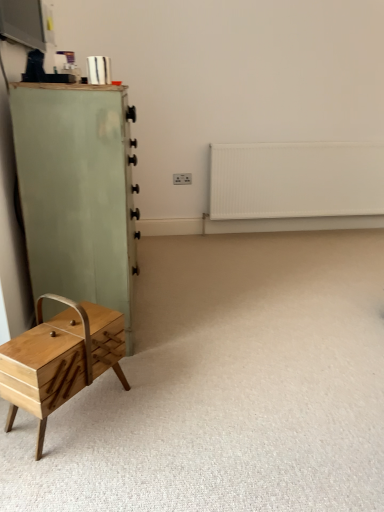
Question: Is the position of light green wood chest of drawers at left more distant than that of wooden sewing box at lower left?

Choices:
 (A) yes
 (B) no

Answer: (A)

Question: Would you say light green wood chest of drawers at left is outside wooden sewing box at lower left?

Choices:
 (A) no
 (B) yes

Answer: (B)

Question: Considering the relative sizes of light green wood chest of drawers at left and wooden sewing box at lower left in the image provided, is light green wood chest of drawers at left bigger than wooden sewing box at lower left?

Choices:
 (A) yes
 (B) no

Answer: (A)

Question: Is light green wood chest of drawers at left in contact with wooden sewing box at lower left?

Choices:
 (A) yes
 (B) no

Answer: (B)

Question: From the image's perspective, is light green wood chest of drawers at left on top of wooden sewing box at lower left?

Choices:
 (A) no
 (B) yes

Answer: (B)

Question: From a real-world perspective, is light green wood chest of drawers at left over wooden sewing box at lower left?

Choices:
 (A) no
 (B) yes

Answer: (B)

Question: Is white matte radiator at upper right touching light green wood chest of drawers at left?

Choices:
 (A) no
 (B) yes

Answer: (A)

Question: Is white matte radiator at upper right bigger than light green wood chest of drawers at left?

Choices:
 (A) no
 (B) yes

Answer: (A)

Question: From the image's perspective, is white matte radiator at upper right beneath light green wood chest of drawers at left?

Choices:
 (A) yes
 (B) no

Answer: (B)

Question: Is white matte radiator at upper right wider than light green wood chest of drawers at left?

Choices:
 (A) yes
 (B) no

Answer: (B)

Question: Does white matte radiator at upper right appear on the left side of light green wood chest of drawers at left?

Choices:
 (A) no
 (B) yes

Answer: (A)

Question: Is white matte radiator at upper right behind light green wood chest of drawers at left?

Choices:
 (A) no
 (B) yes

Answer: (B)

Question: Does natural wood drawer at lower left have a greater height compared to wooden sewing box at lower left?

Choices:
 (A) yes
 (B) no

Answer: (A)